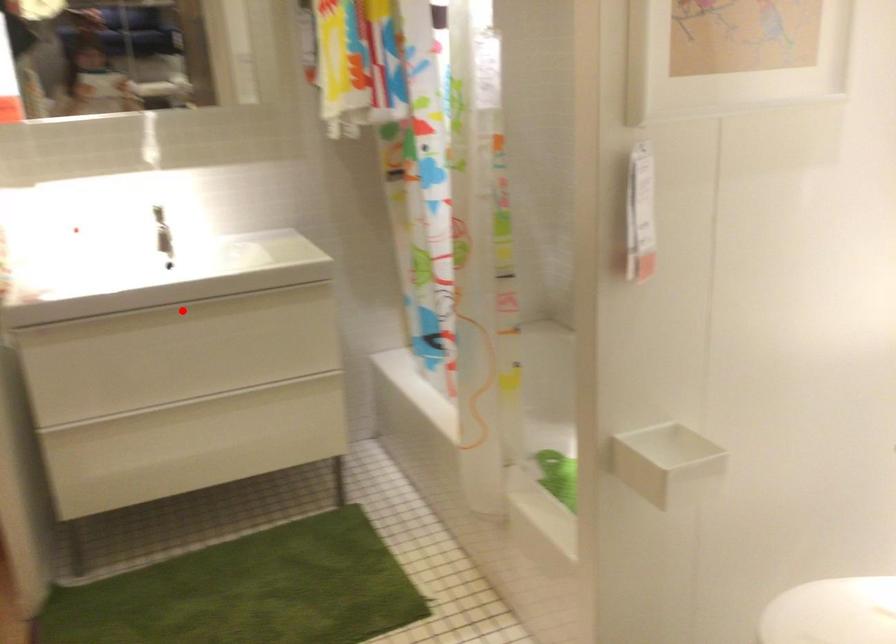
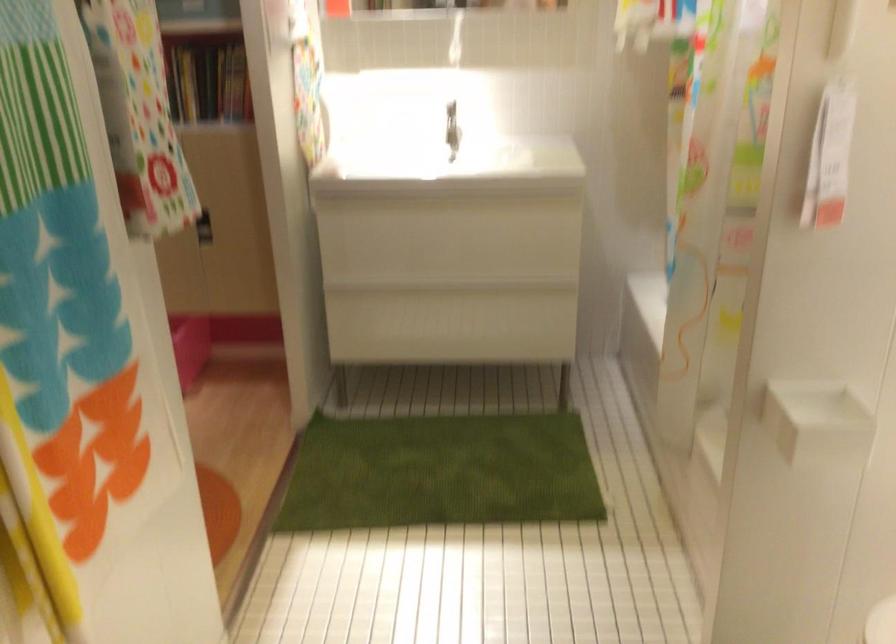
Where in the second image is the point corresponding to the highlighted location from the first image?

(440, 201)